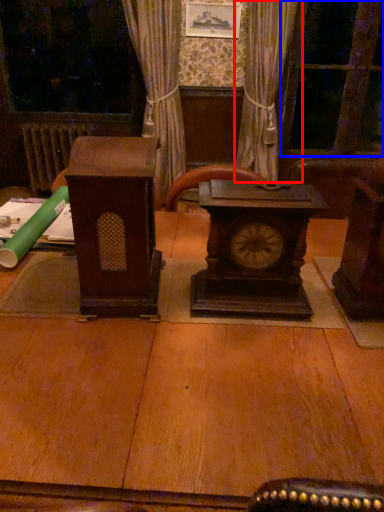
Question: Which of the following is the farthest to the observer, curtain (highlighted by a red box) or glass door (highlighted by a blue box)?

Choices:
 (A) curtain
 (B) glass door

Answer: (B)